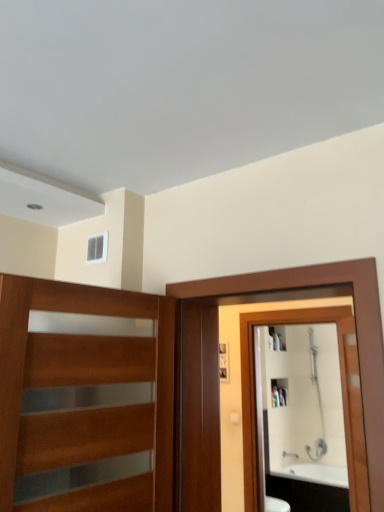
Question: Is brown wooden screen door at right oriented towards white glossy mirror at right?

Choices:
 (A) no
 (B) yes

Answer: (A)

Question: Is brown wooden screen door at right smaller than white glossy mirror at right?

Choices:
 (A) yes
 (B) no

Answer: (B)

Question: Is brown wooden screen door at right bigger than white glossy mirror at right?

Choices:
 (A) no
 (B) yes

Answer: (B)

Question: Considering the relative sizes of brown wooden screen door at right and white glossy mirror at right in the image provided, is brown wooden screen door at right taller than white glossy mirror at right?

Choices:
 (A) no
 (B) yes

Answer: (A)

Question: From the image's perspective, is brown wooden screen door at right beneath white glossy mirror at right?

Choices:
 (A) no
 (B) yes

Answer: (A)

Question: Based on their sizes in the image, would you say silver metallic faucet at lower right is bigger or smaller than white plastic vent at upper center?

Choices:
 (A) big
 (B) small

Answer: (A)

Question: Relative to white plastic vent at upper center, is silver metallic faucet at lower right in front or behind?

Choices:
 (A) behind
 (B) front

Answer: (A)

Question: Based on their positions, is silver metallic faucet at lower right located to the left or right of white plastic vent at upper center?

Choices:
 (A) right
 (B) left

Answer: (A)

Question: From the image's perspective, is silver metallic faucet at lower right located above or below white plastic vent at upper center?

Choices:
 (A) below
 (B) above

Answer: (A)

Question: Considering the relative positions of brown wooden screen door at right and white glossy cabinet at upper center in the image provided, is brown wooden screen door at right to the left or to the right of white glossy cabinet at upper center?

Choices:
 (A) right
 (B) left

Answer: (B)

Question: Considering the positions of brown wooden screen door at right and white glossy cabinet at upper center in the image, is brown wooden screen door at right taller or shorter than white glossy cabinet at upper center?

Choices:
 (A) tall
 (B) short

Answer: (A)

Question: Is brown wooden screen door at right wider or thinner than white glossy cabinet at upper center?

Choices:
 (A) thin
 (B) wide

Answer: (B)

Question: Does point (196, 367) appear closer or farther from the camera than point (276, 403)?

Choices:
 (A) farther
 (B) closer

Answer: (B)

Question: From a real-world perspective, relative to white glossy cabinet at upper center, is white plastic vent at upper center vertically above or below?

Choices:
 (A) below
 (B) above

Answer: (B)

Question: In terms of width, does white plastic vent at upper center look wider or thinner when compared to white glossy cabinet at upper center?

Choices:
 (A) wide
 (B) thin

Answer: (B)